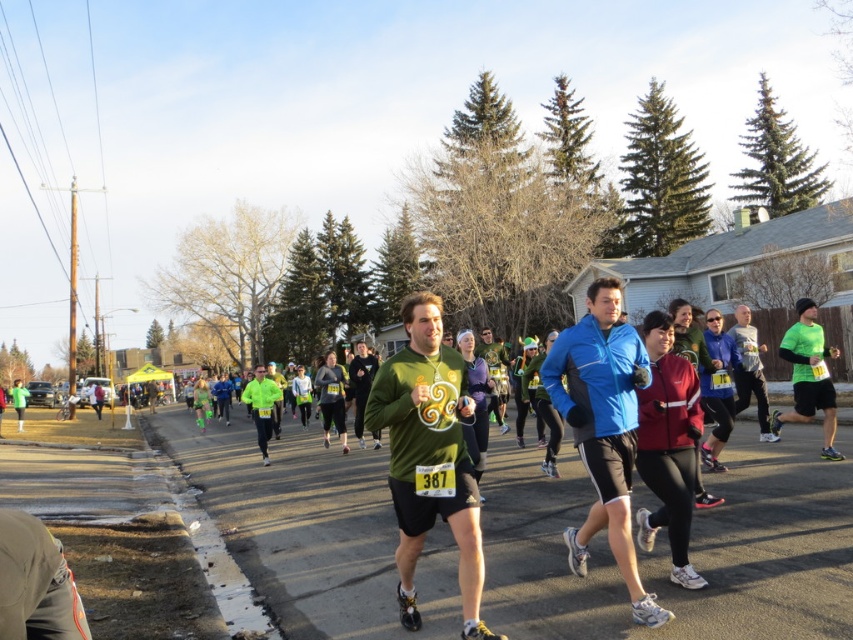
Question: Does blue fabric jacket at center appear on the right side of green fleece jacket at center?

Choices:
 (A) yes
 (B) no

Answer: (B)

Question: Does blue fabric jacket at center come behind green matte shirt at center?

Choices:
 (A) no
 (B) yes

Answer: (B)

Question: Which object is the farthest from the neon green fabric at center?

Choices:
 (A) green matte sweater at center
 (B) green matte shirt at center
 (C) green matte long-sleeve shirt at center

Answer: (C)

Question: Is neon green fabric at center to the right of green matte sweater at center from the viewer's perspective?

Choices:
 (A) yes
 (B) no

Answer: (B)

Question: Which point is closer to the camera taking this photo?

Choices:
 (A) (262, 456)
 (B) (751, 376)

Answer: (B)

Question: Which of the following is the farthest from the observer?

Choices:
 (A) neon green fabric at center
 (B) green fleece jacket at center
 (C) green matte shirt at center

Answer: (A)